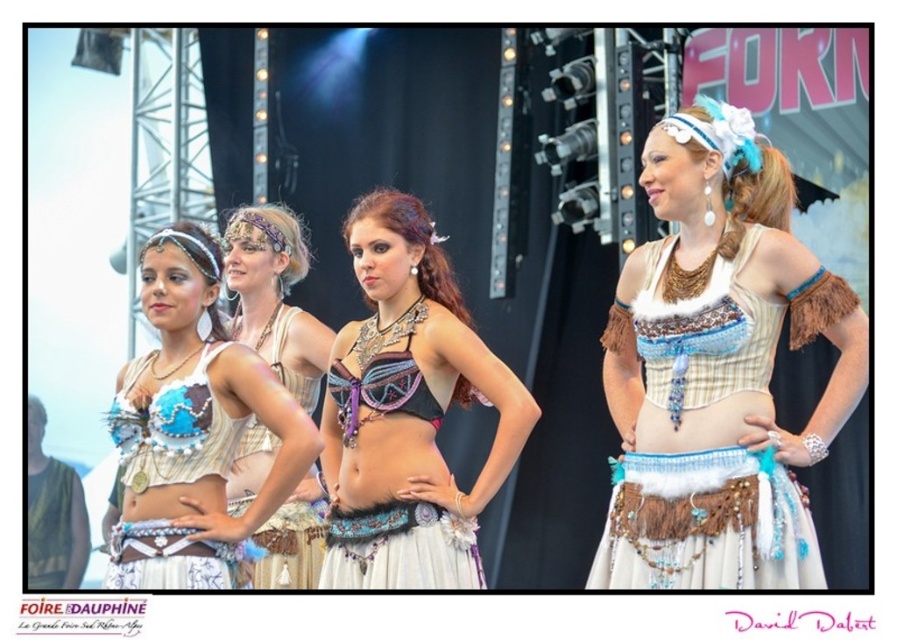
You are a photographer who needs to capture the shiny purple fabric bra at center. Based on the scene description, where should you position your camera to ensure it is in the frame?

The shiny purple fabric bra at center is located at point (x=407, y=412), so position the camera to frame the center of the image at those coordinates to capture it.

You are a photographer at the FOIRE DAUPHINE event and need to capture a closeup shot of the shiny purple fabric bra at center and the matte white fabric at center. Which object should you focus on first if you want to ensure both are in focus without adjusting the camera settings?

The shiny purple fabric bra at center has a greater height compared to the matte white fabric at center, so focusing on the taller shiny purple fabric bra at center first would ensure both are in focus since it is farther from the camera.

You are an event photographer at the FOIRE DAUPHINE. You need to capture a closeup shot of both the shiny purple fabric bra at center and the matte blue fabric bra at left. Since your camera can only focus on one subject at a time, which bra should you choose to ensure the one with the greater height is in focus?

The shiny purple fabric bra at center has a greater height compared to the matte blue fabric bra at left, so you should focus on the shiny purple fabric bra at center to ensure the taller one is in focus.